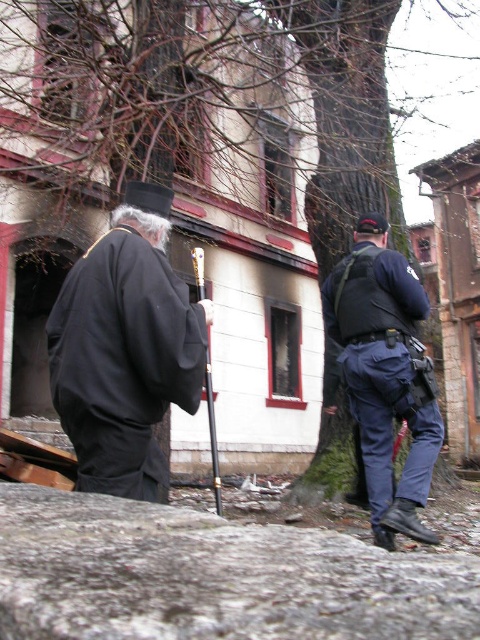
Question: Which object is positioned closest to the black matte robe at left?

Choices:
 (A) navy blue uniform at right
 (B) gray rough stone at lower center

Answer: (B)

Question: Is black matte robe at left bigger than navy blue uniform at right?

Choices:
 (A) no
 (B) yes

Answer: (A)

Question: Which object is closer to the camera taking this photo?

Choices:
 (A) black matte robe at left
 (B) navy blue uniform at right

Answer: (A)

Question: Which object is the farthest from the black matte robe at left?

Choices:
 (A) gray rough stone at lower center
 (B) navy blue uniform at right

Answer: (B)

Question: Is gray rough stone at lower center below navy blue uniform at right?

Choices:
 (A) no
 (B) yes

Answer: (B)

Question: In this image, where is gray rough stone at lower center located relative to black matte robe at left?

Choices:
 (A) right
 (B) left

Answer: (A)